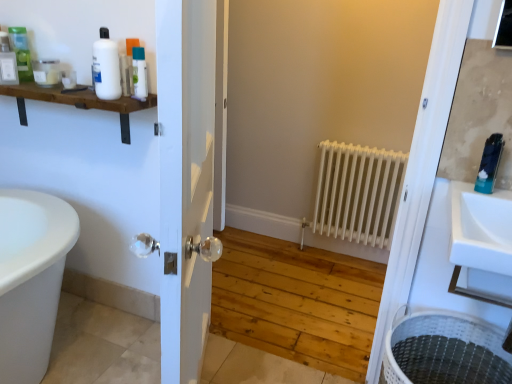
The width and height of the screenshot is (512, 384). Find the location of `white woven laundry basket at lower right`. white woven laundry basket at lower right is located at coordinates (445, 350).

This screenshot has height=384, width=512. Identify the location of white glass door at center. (185, 178).

Describe the element at coordinates (185, 178) in the screenshot. I see `white glass door at center` at that location.

How much space does matte white bottle at upper left, marked as the 1th toiletry in a left-to-right arrangement, occupy vertically?

The height of matte white bottle at upper left, marked as the 1th toiletry in a left-to-right arrangement, is 7.66 inches.

The height and width of the screenshot is (384, 512). Identify the location of blue glossy toothpaste tube at upper right, which is the 7th toiletry from left to right. pos(489,164).

How much distance is there between matte white jar at upper left, which ranks as the 5th toiletry in right-to-left order, and white glossy bottle at upper left, which is the fourth toiletry from right to left?

A distance of 7.03 centimeters exists between matte white jar at upper left, which ranks as the 5th toiletry in right-to-left order, and white glossy bottle at upper left, which is the fourth toiletry from right to left.

From the image's perspective, would you say matte white jar at upper left, arranged as the 3th toiletry when viewed from the left, is shown under white glossy bottle at upper left, which is the fourth toiletry from right to left?

Incorrect, from the image's perspective, matte white jar at upper left, arranged as the 3th toiletry when viewed from the left, is higher than white glossy bottle at upper left, which is the fourth toiletry from right to left.

Considering the positions of objects matte white jar at upper left, arranged as the 3th toiletry when viewed from the left, and white glossy bottle at upper left, which is the fourth toiletry from right to left, in the image provided, who is in front, matte white jar at upper left, arranged as the 3th toiletry when viewed from the left, or white glossy bottle at upper left, which is the fourth toiletry from right to left,?

white glossy bottle at upper left, which is the fourth toiletry from right to left, is in front.

Does matte white jar at upper left, arranged as the 3th toiletry when viewed from the left, have a lesser height compared to white glossy bottle at upper left, which is the fourth toiletry from right to left?

In fact, matte white jar at upper left, arranged as the 3th toiletry when viewed from the left, may be taller than white glossy bottle at upper left, which is the fourth toiletry from right to left.

Does white matte radiator at center have a greater height compared to translucent plastic bottle at upper left, which is the sixth toiletry from left to right?

Correct, white matte radiator at center is much taller as translucent plastic bottle at upper left, which is the sixth toiletry from left to right.

Is white matte radiator at center next to translucent plastic bottle at upper left, the 2th toiletry from the right?

No, white matte radiator at center is not with translucent plastic bottle at upper left, the 2th toiletry from the right.

Is white matte radiator at center in front of or behind translucent plastic bottle at upper left, the 2th toiletry from the right, in the image?

In the image, white matte radiator at center appears behind translucent plastic bottle at upper left, the 2th toiletry from the right.

Looking at this image, based on their sizes in the image, would you say white matte radiator at center is bigger or smaller than translucent plastic bottle at upper left, which is the sixth toiletry from left to right?

Considering their sizes, white matte radiator at center takes up more space than translucent plastic bottle at upper left, which is the sixth toiletry from left to right.

How different are the orientations of white woven laundry basket at lower right and blue glossy toothpaste tube at upper right, the 1th toiletry viewed from the right, in degrees?

They differ by 0.537 degrees in their facing directions.

Considering the relative sizes of white woven laundry basket at lower right and blue glossy toothpaste tube at upper right, which is the 7th toiletry from left to right, in the image provided, is white woven laundry basket at lower right bigger than blue glossy toothpaste tube at upper right, which is the 7th toiletry from left to right,?

Indeed, white woven laundry basket at lower right has a larger size compared to blue glossy toothpaste tube at upper right, which is the 7th toiletry from left to right.

Which is more to the left, white woven laundry basket at lower right or blue glossy toothpaste tube at upper right, the 1th toiletry viewed from the right?

white woven laundry basket at lower right is more to the left.

Considering the points (438, 352) and (497, 156), which point is behind, point (438, 352) or point (497, 156)?

The point (438, 352) is farther from the camera.

Is point (142, 87) closer or farther from the camera than point (13, 52)?

Point (142, 87) is positioned closer to the camera compared to point (13, 52).

Is translucent plastic bottle at upper left, the 2th toiletry from the right, situated inside matte white bottle at upper left, which ranks as the seventh toiletry in right-to-left order, or outside?

translucent plastic bottle at upper left, the 2th toiletry from the right, is spatially situated outside matte white bottle at upper left, which ranks as the seventh toiletry in right-to-left order.

Which of these two, translucent plastic bottle at upper left, which is the sixth toiletry from left to right, or matte white bottle at upper left, which ranks as the seventh toiletry in right-to-left order, is smaller?

With smaller size is matte white bottle at upper left, which ranks as the seventh toiletry in right-to-left order.

Is translucent plastic bottle at upper left, the 2th toiletry from the right, at the right side of matte white bottle at upper left, marked as the 1th toiletry in a left-to-right arrangement?

Correct, you'll find translucent plastic bottle at upper left, the 2th toiletry from the right, to the right of matte white bottle at upper left, marked as the 1th toiletry in a left-to-right arrangement.

Is translucent plastic bottle at upper left, the 2th toiletry from the right, positioned with its back to matte white jar at upper left, arranged as the 3th toiletry when viewed from the left?

translucent plastic bottle at upper left, the 2th toiletry from the right, is not turned away from matte white jar at upper left, arranged as the 3th toiletry when viewed from the left.

From the image's perspective, which one is positioned lower, translucent plastic bottle at upper left, the 2th toiletry from the right, or matte white jar at upper left, which ranks as the 5th toiletry in right-to-left order?

translucent plastic bottle at upper left, the 2th toiletry from the right, from the image's perspective.

Between translucent plastic bottle at upper left, the 2th toiletry from the right, and matte white jar at upper left, arranged as the 3th toiletry when viewed from the left, which one has less height?

matte white jar at upper left, arranged as the 3th toiletry when viewed from the left, is shorter.

Does translucent plastic bottle at upper left, which is the sixth toiletry from left to right, have a smaller size compared to matte white jar at upper left, which ranks as the 5th toiletry in right-to-left order?

Yes, translucent plastic bottle at upper left, which is the sixth toiletry from left to right, is smaller than matte white jar at upper left, which ranks as the 5th toiletry in right-to-left order.

You are a GUI agent. You are given a task and a screenshot of the screen. Output one action in this format:
    pyautogui.click(x=<x>, y=<y>)
    Task: Click on the 2nd toiletry behind the matte white jar at upper left, arranged as the 3th toiletry when viewed from the left, starting your count from the anchor
    The height and width of the screenshot is (384, 512).
    Given the screenshot: What is the action you would take?
    pyautogui.click(x=7, y=62)

From a real-world perspective, does matte white bottle at upper left, which ranks as the seventh toiletry in right-to-left order, sit lower than matte white jar at upper left, which ranks as the 5th toiletry in right-to-left order?

No, from a real-world perspective, matte white bottle at upper left, which ranks as the seventh toiletry in right-to-left order, is not below matte white jar at upper left, which ranks as the 5th toiletry in right-to-left order.

Considering the sizes of objects matte white bottle at upper left, marked as the 1th toiletry in a left-to-right arrangement, and matte white jar at upper left, arranged as the 3th toiletry when viewed from the left, in the image provided, who is bigger, matte white bottle at upper left, marked as the 1th toiletry in a left-to-right arrangement, or matte white jar at upper left, arranged as the 3th toiletry when viewed from the left,?

matte white jar at upper left, arranged as the 3th toiletry when viewed from the left, is bigger.

Consider the image. Is white glossy bottle at upper left, which appears as the 4th toiletry when viewed from the left, turned away from matte white jar at upper left, which ranks as the 5th toiletry in right-to-left order?

white glossy bottle at upper left, which appears as the 4th toiletry when viewed from the left, is not turned away from matte white jar at upper left, which ranks as the 5th toiletry in right-to-left order.

From the image's perspective, is white glossy bottle at upper left, which is the fourth toiletry from right to left, above or below matte white jar at upper left, which ranks as the 5th toiletry in right-to-left order?

white glossy bottle at upper left, which is the fourth toiletry from right to left, is situated lower than matte white jar at upper left, which ranks as the 5th toiletry in right-to-left order, in the image.

Is white glossy bottle at upper left, which appears as the 4th toiletry when viewed from the left, beside matte white jar at upper left, arranged as the 3th toiletry when viewed from the left?

Indeed, white glossy bottle at upper left, which appears as the 4th toiletry when viewed from the left, and matte white jar at upper left, arranged as the 3th toiletry when viewed from the left, are beside each other and touching.

From a real-world perspective, count 1st toiletrys downward from the matte white jar at upper left, which ranks as the 5th toiletry in right-to-left order, and point to it. Please provide its 2D coordinates.

[(69, 79)]

Where is `the 4th toiletry above the white matte radiator at center (from the image's perspective)`? the 4th toiletry above the white matte radiator at center (from the image's perspective) is located at coordinates (139, 74).

Looking at the image, which one is located closer to matte white jar at upper left, arranged as the 3th toiletry when viewed from the left, white glossy bottle at upper left, placed as the fifth toiletry when sorted from left to right, or translucent plastic bottle at upper left, which is the sixth toiletry from left to right?

white glossy bottle at upper left, placed as the fifth toiletry when sorted from left to right, is closer to matte white jar at upper left, arranged as the 3th toiletry when viewed from the left.

When comparing their distances from matte green bottle at upper left, which appears as the sixth toiletry when viewed from the right, does white glossy bottle at upper left, placed as the fifth toiletry when sorted from left to right, or blue glossy toothpaste tube at upper right, the 1th toiletry viewed from the right, seem further?

blue glossy toothpaste tube at upper right, the 1th toiletry viewed from the right, lies further to matte green bottle at upper left, which appears as the sixth toiletry when viewed from the right, than the other object.

When comparing their distances from translucent plastic bottle at upper left, the 2th toiletry from the right, does white matte radiator at center or matte white jar at upper left, arranged as the 3th toiletry when viewed from the left, seem closer?

matte white jar at upper left, arranged as the 3th toiletry when viewed from the left, is closer to translucent plastic bottle at upper left, the 2th toiletry from the right.

Looking at the image, which one is located further to matte white bottle at upper left, which ranks as the seventh toiletry in right-to-left order, matte white jar at upper left, which ranks as the 5th toiletry in right-to-left order, or white woven laundry basket at lower right?

white woven laundry basket at lower right.

Considering their positions, is white glossy bottle at upper left, which appears as the 4th toiletry when viewed from the left, positioned closer to translucent plastic bottle at upper left, the 2th toiletry from the right, than matte green bottle at upper left, marked as the second toiletry in a left-to-right arrangement?

white glossy bottle at upper left, which appears as the 4th toiletry when viewed from the left, lies closer to translucent plastic bottle at upper left, the 2th toiletry from the right, than the other object.

From the image, which object appears to be farther from translucent plastic bottle at upper left, which is the sixth toiletry from left to right, white glass door at center or white woven laundry basket at lower right?

white woven laundry basket at lower right lies further to translucent plastic bottle at upper left, which is the sixth toiletry from left to right, than the other object.

Looking at this image, estimate the real-world distances between objects in this image. Which object is further from white woven laundry basket at lower right, matte green bottle at upper left, which appears as the sixth toiletry when viewed from the right, or white glossy bottle at upper left, which is counted as the third toiletry, starting from the right?

matte green bottle at upper left, which appears as the sixth toiletry when viewed from the right.

When comparing their distances from blue glossy toothpaste tube at upper right, the 1th toiletry viewed from the right, does white matte shelf at upper left or white matte radiator at center seem closer?

white matte radiator at center.

Locate an element on the screen. This screenshot has height=384, width=512. laundry basket between white glass door at center and white matte radiator at center from front to back is located at coordinates (445, 350).

This screenshot has width=512, height=384. What are the coordinates of `radiator situated between matte green bottle at upper left, which appears as the sixth toiletry when viewed from the right, and white woven laundry basket at lower right from left to right` in the screenshot? It's located at (358, 193).

Where is `door between white glossy bottle at upper left, which is counted as the third toiletry, starting from the right, and white woven laundry basket at lower right`? The height and width of the screenshot is (384, 512). door between white glossy bottle at upper left, which is counted as the third toiletry, starting from the right, and white woven laundry basket at lower right is located at coordinates (185, 178).

The width and height of the screenshot is (512, 384). I want to click on door between white matte shelf at upper left and white woven laundry basket at lower right in the horizontal direction, so click(x=185, y=178).